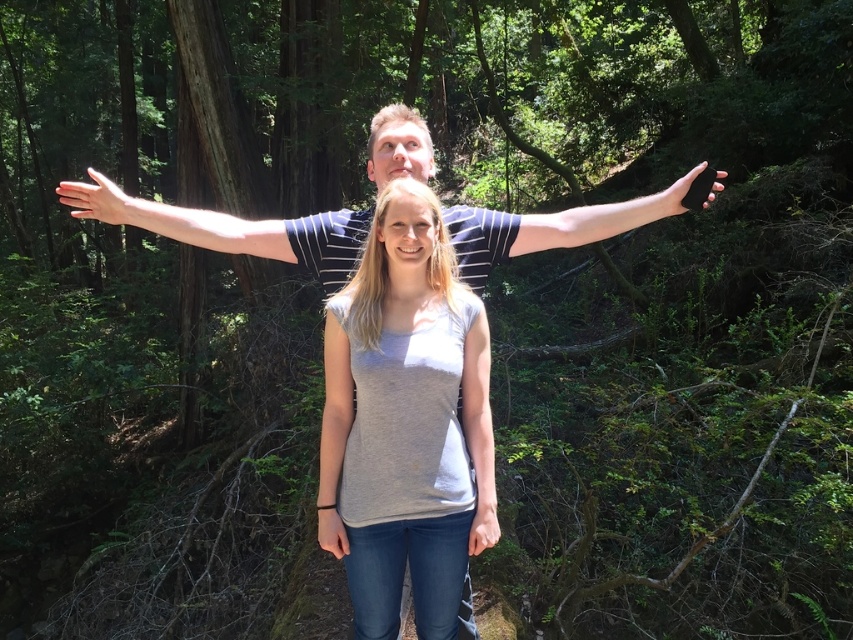
Is matte black phone at lower center to the right of matte gray wristband at lower center from the viewer's perspective?

Correct, you'll find matte black phone at lower center to the right of matte gray wristband at lower center.

Which is above, matte black phone at lower center or matte gray wristband at lower center?

Positioned higher is matte black phone at lower center.

Locate an element on the screen. The height and width of the screenshot is (640, 853). matte black phone at lower center is located at coordinates pyautogui.click(x=483, y=528).

At what (x,y) coordinates should I click in order to perform the action: click on matte black phone at lower center. Please return your answer as a coordinate pair (x, y). The width and height of the screenshot is (853, 640). Looking at the image, I should click on coord(483,528).

Between point (471, 396) and point (490, 544), which one is positioned behind?

Positioned behind is point (471, 396).

Can you confirm if gray matte tank top at center is smaller than matte black phone at lower center?

No, gray matte tank top at center is not smaller than matte black phone at lower center.

Image resolution: width=853 pixels, height=640 pixels. Describe the element at coordinates (479, 433) in the screenshot. I see `gray matte tank top at center` at that location.

Identify the location of gray matte tank top at center. The width and height of the screenshot is (853, 640). (479, 433).

Is smooth skin arm at left shorter than gray matte shirt at center?

Yes.

Is point (244, 221) less distant than point (335, 396)?

No, it is behind (335, 396).

Find the location of `smooth skin arm at left`. smooth skin arm at left is located at coordinates pos(177,220).